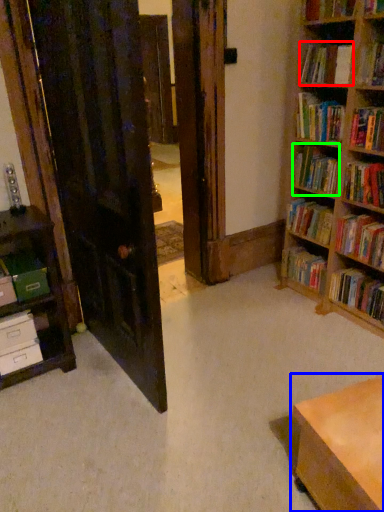
Question: Based on their relative distances, which object is farther from book (highlighted by a red box)? Choose from table (highlighted by a blue box) and book (highlighted by a green box).

Choices:
 (A) table
 (B) book

Answer: (A)